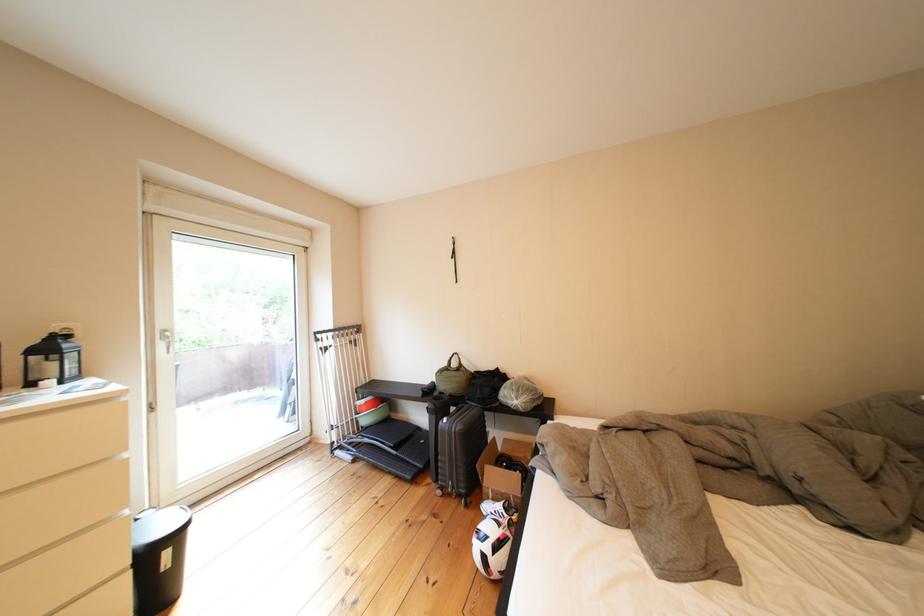
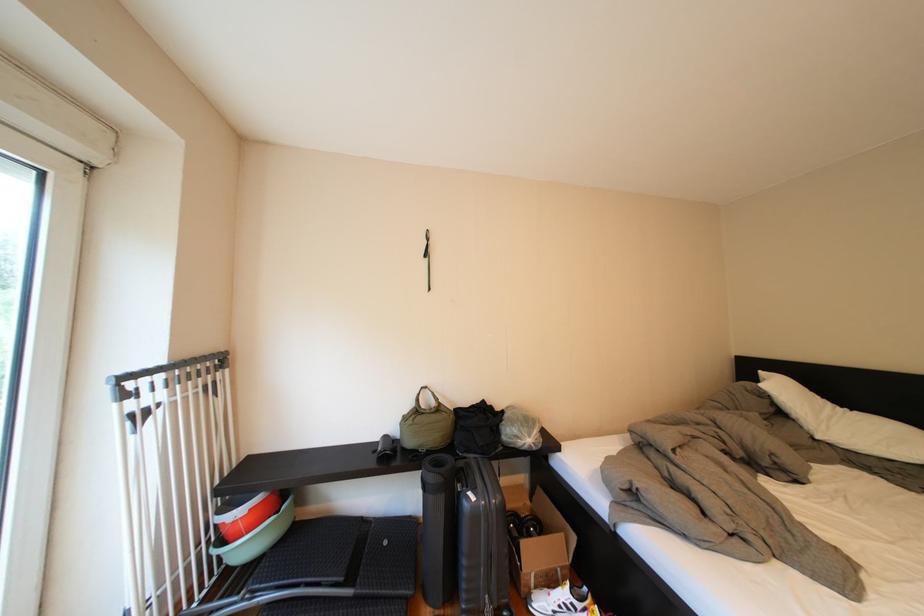
Where in the second image is the point corresponding to (500,511) from the first image?

(554, 609)